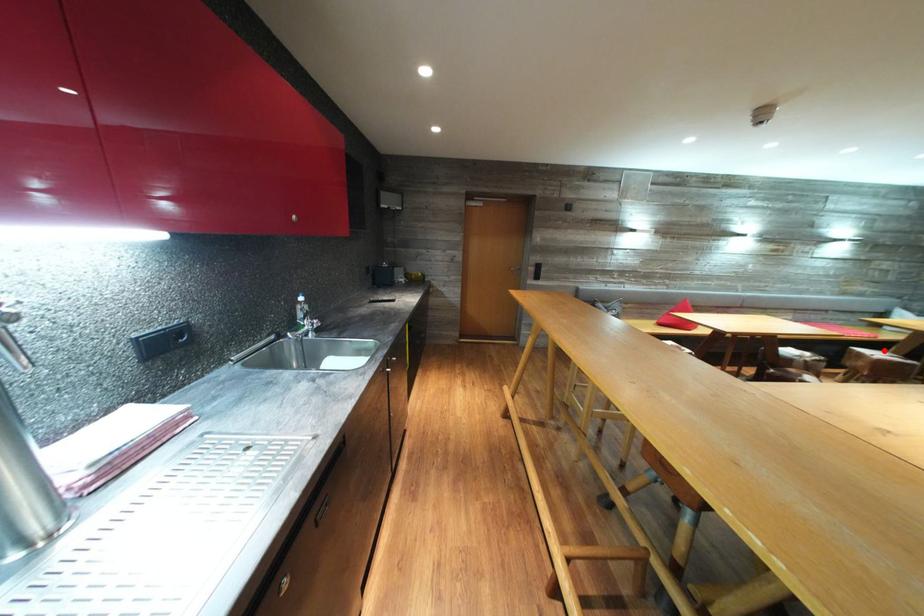
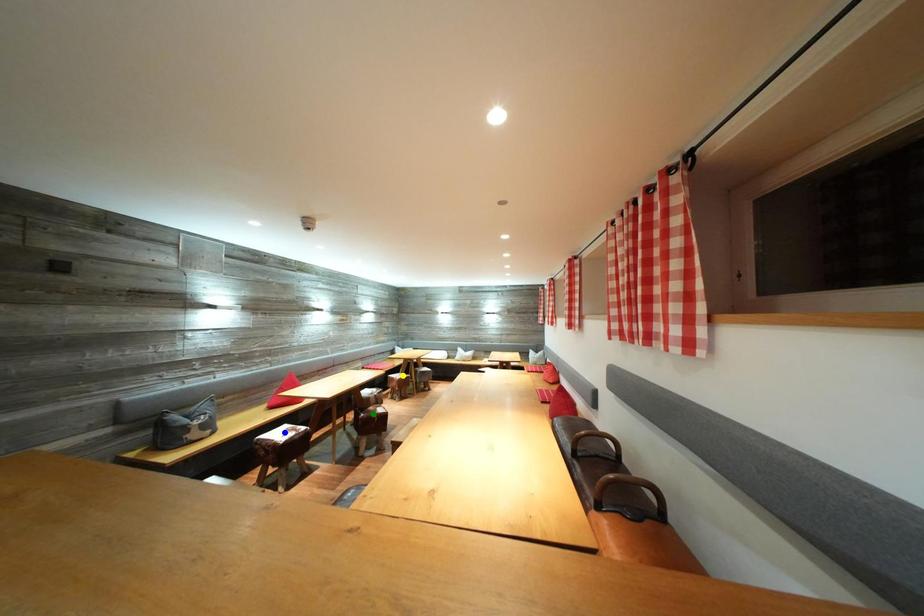
Question: I am providing you with two images of the same scene from different viewpoints. A red point is marked on the first image. You are given multiple points on the second image. Can you choose the point in image 2 that corresponds to the point in image 1?

Choices:
 (A) yellow point
 (B) green point
 (C) blue point

Answer: (A)